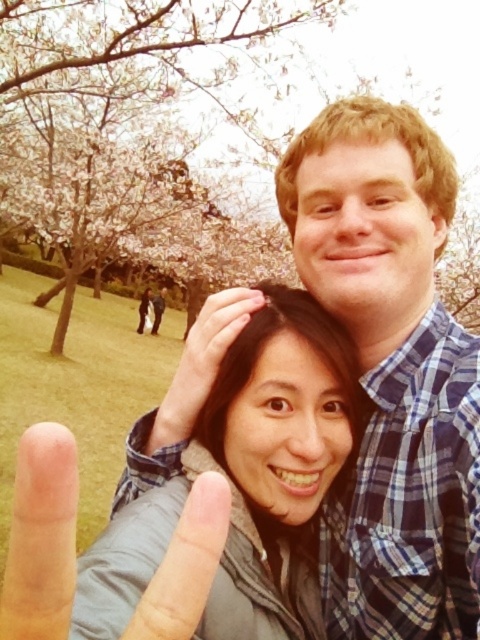
You are trying to decide which object in the scene is bigger between the blue plaid shirt at center and the matte skin at center. Based on the description, which one is larger?

The blue plaid shirt at center has a larger size compared to matte skin at center, so the blue plaid shirt at center is bigger.

You are standing in the park and want to take a selfie with the matte gray jacket at center. Where should you position yourself to include the jacket in the frame?

To include the matte gray jacket at center in the frame, position yourself so that the jacket is centered at point 0.755 on the horizontal axis and 0.515 on the vertical axis of your camera viewfinder.